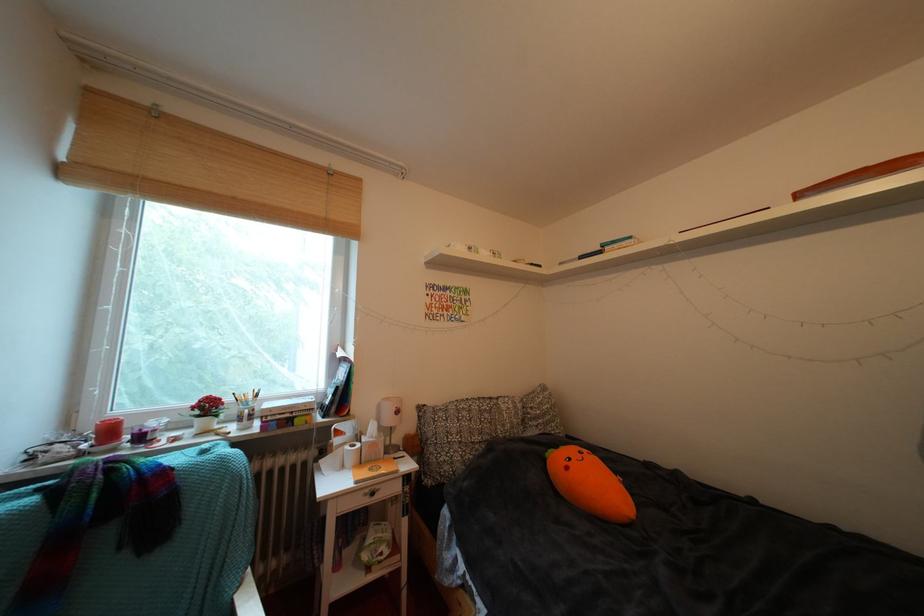
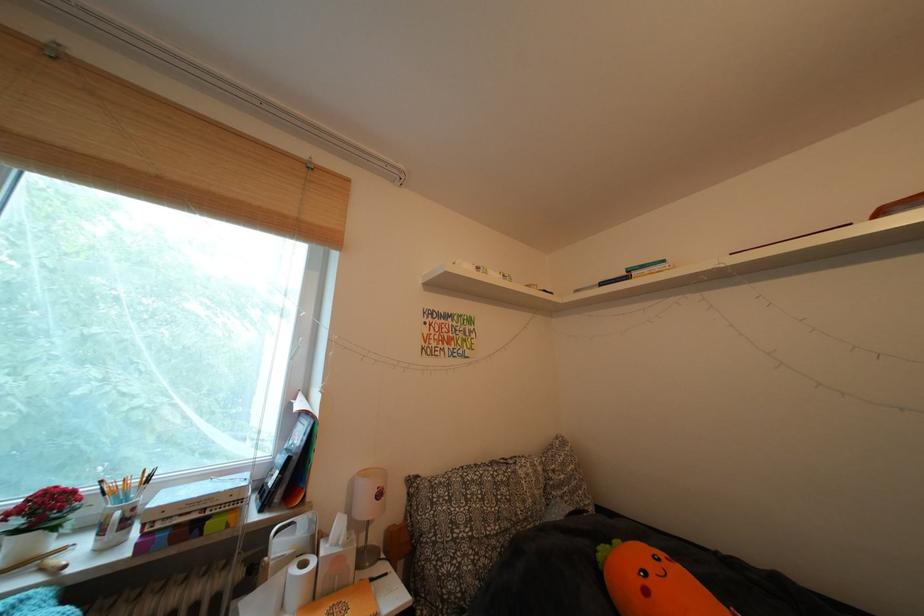
Where in the second image is the point corresponding to point 398,424 from the first image?

(375, 513)